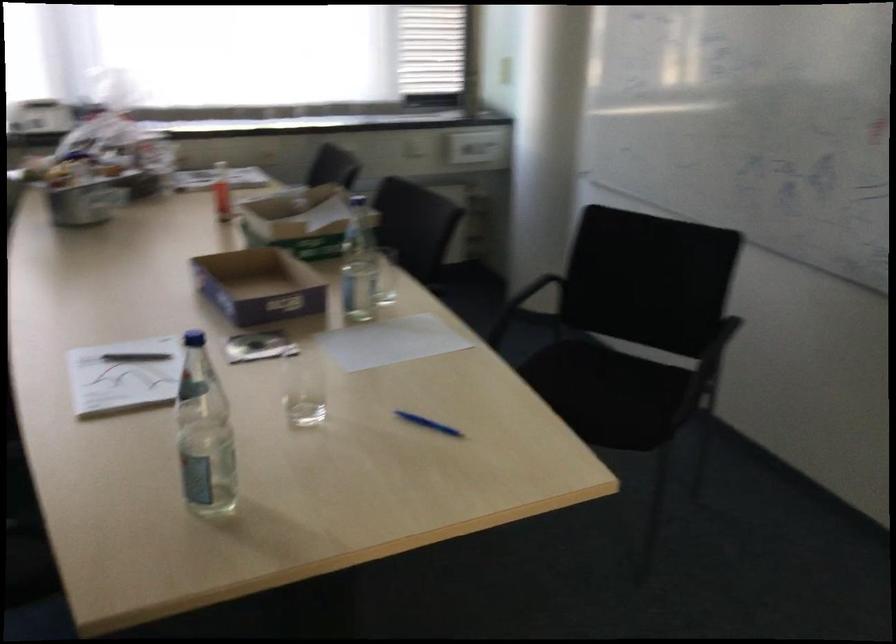
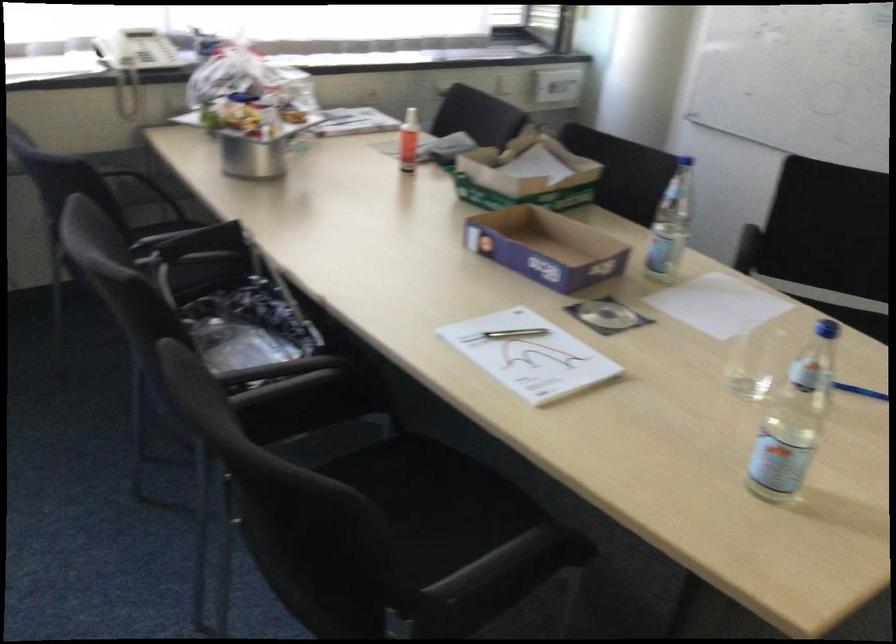
The point at (351, 393) is marked in the first image. Where is the corresponding point in the second image?

(754, 362)